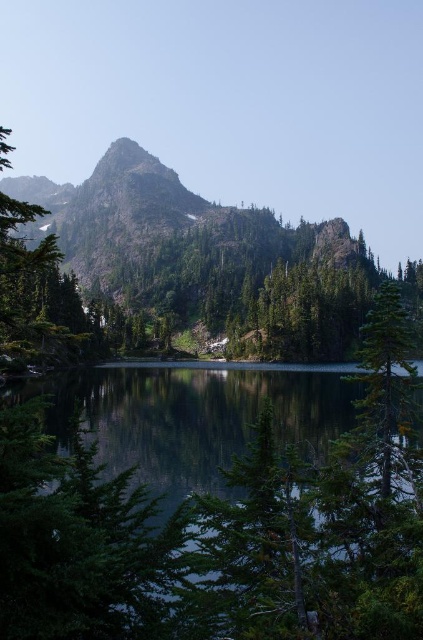
You are standing at the edge of the lake in the serene mountain landscape. There is a point marked at coordinates (197, 547) which corresponds to green reflective water at center. If you want to reach this point, which direction should you walk from your current position at the edge of the lake?

The point marked at (197, 547) corresponds to the green reflective water at center. Since you are at the edge of the lake, you should walk towards the center of the lake to reach this point.

You are standing at the edge of the lake in the serene mountain landscape. You notice two points marked in the scene. Which point, point (71,488) or point (392,413), is closer to you?

Point (71,488) is closer to the viewer than point (392,413).